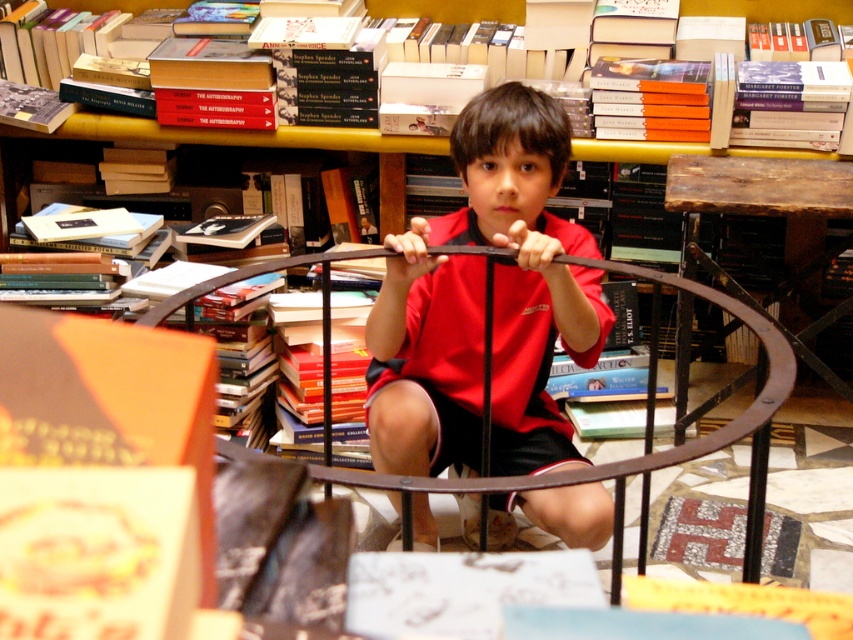
Who is lower down, red matte shirt at center or rustic wood table at center?

red matte shirt at center

Is red matte shirt at center wider than rustic wood table at center?

No.

Which is behind, point (480, 208) or point (759, 164)?

The point (759, 164) is more distant.

Identify the location of red matte shirt at center. This screenshot has height=640, width=853. (483, 305).

Is metallic bookshelf at upper center below rustic wood table at center?

Actually, metallic bookshelf at upper center is above rustic wood table at center.

Is metallic bookshelf at upper center closer to the viewer compared to rustic wood table at center?

No.

Is point (279, 145) closer to camera compared to point (672, 154)?

That is False.

This screenshot has height=640, width=853. In order to click on metallic bookshelf at upper center in this screenshot , I will do `click(238, 134)`.

Is point (535, 339) behind point (99, 129)?

No, it is not.

Is red matte shirt at center smaller than hardcover book at upper center?

Actually, red matte shirt at center might be larger than hardcover book at upper center.

Identify the location of red matte shirt at center. The width and height of the screenshot is (853, 640). (483, 305).